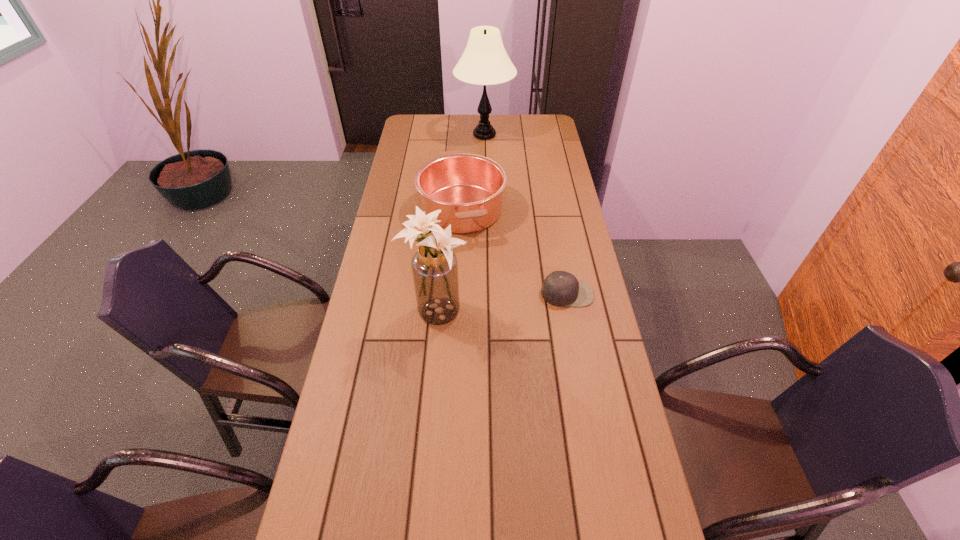
The image size is (960, 540). What are the coordinates of `blank area located 0.390m on the brim of the rightmost object` in the screenshot? It's located at (591, 426).

What are the coordinates of `object situated at the far edge` in the screenshot? It's located at (484, 62).

Identify the location of flower arrangement located in the left edge section of the desktop. The image size is (960, 540). (434, 266).

Where is `saucepan positioned at the left edge`? This screenshot has width=960, height=540. saucepan positioned at the left edge is located at coordinates (468, 189).

Locate an element on the screen. This screenshot has height=540, width=960. object that is at the right edge is located at coordinates (560, 288).

Find the location of a particular element. The width and height of the screenshot is (960, 540). vacant space at the left edge of the desktop is located at coordinates (408, 139).

This screenshot has height=540, width=960. In order to click on vacant space at the right edge in this screenshot , I will do `click(533, 193)`.

The image size is (960, 540). In the image, there is a desktop. Find the location of `vacant space at the far right corner`. vacant space at the far right corner is located at coordinates (549, 123).

The height and width of the screenshot is (540, 960). Identify the location of free space between the shortest object and the lamp. (526, 214).

Locate an element on the screen. vacant area that lies between the rightmost object and the lamp is located at coordinates (526, 214).